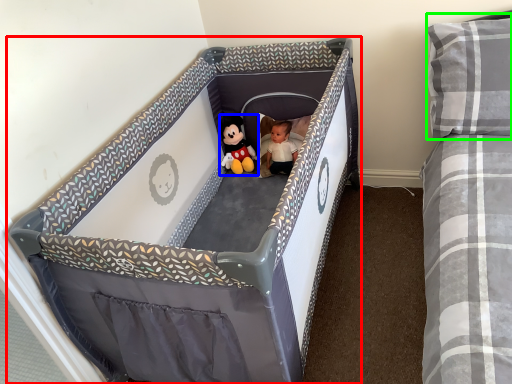
Question: Which is farther away from infant bed (highlighted by a red box)? toy (highlighted by a blue box) or pillow (highlighted by a green box)?

Choices:
 (A) toy
 (B) pillow

Answer: (B)